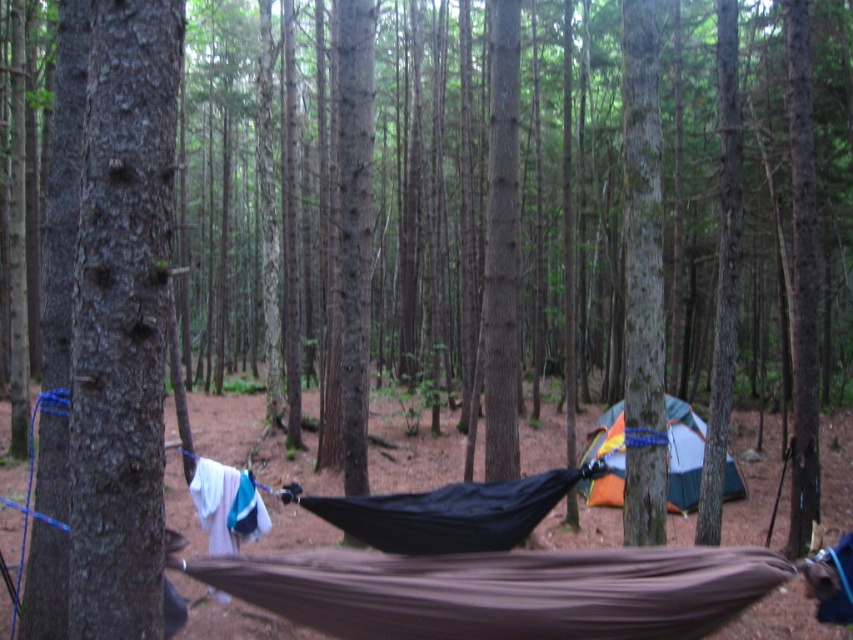
Question: Does brown rough bark at left have a greater width compared to green canvas tent at center?

Choices:
 (A) yes
 (B) no

Answer: (B)

Question: Is brown rough bark at left below green canvas tent at center?

Choices:
 (A) yes
 (B) no

Answer: (B)

Question: Among these objects, which one is nearest to the camera?

Choices:
 (A) green canvas tent at center
 (B) brown rough bark at left

Answer: (B)

Question: Can you confirm if brown rough bark at left is bigger than green canvas tent at center?

Choices:
 (A) no
 (B) yes

Answer: (A)